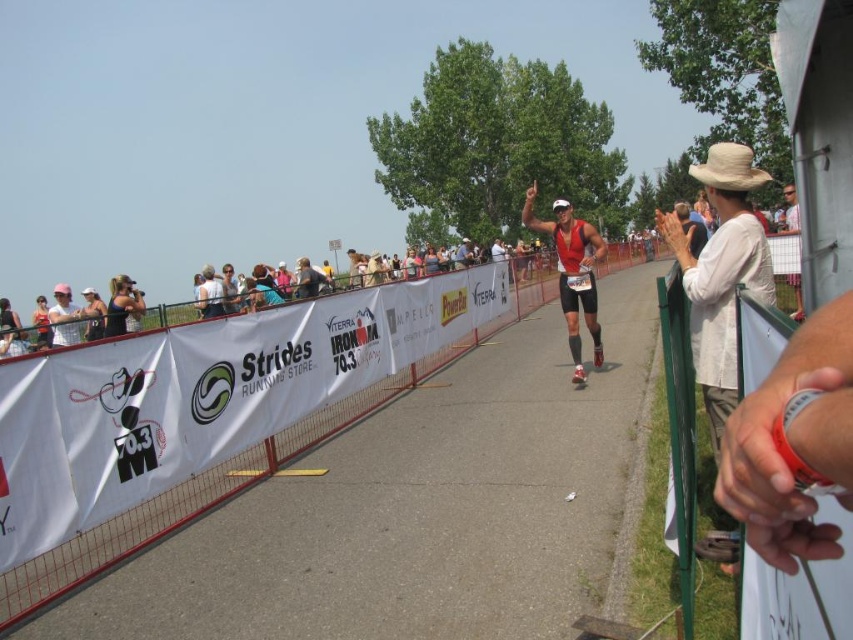
Does matte red triathlon suit at center have a smaller size compared to white cotton shirt at right?

Yes, matte red triathlon suit at center is smaller than white cotton shirt at right.

Locate an element on the screen. matte red triathlon suit at center is located at coordinates (572, 273).